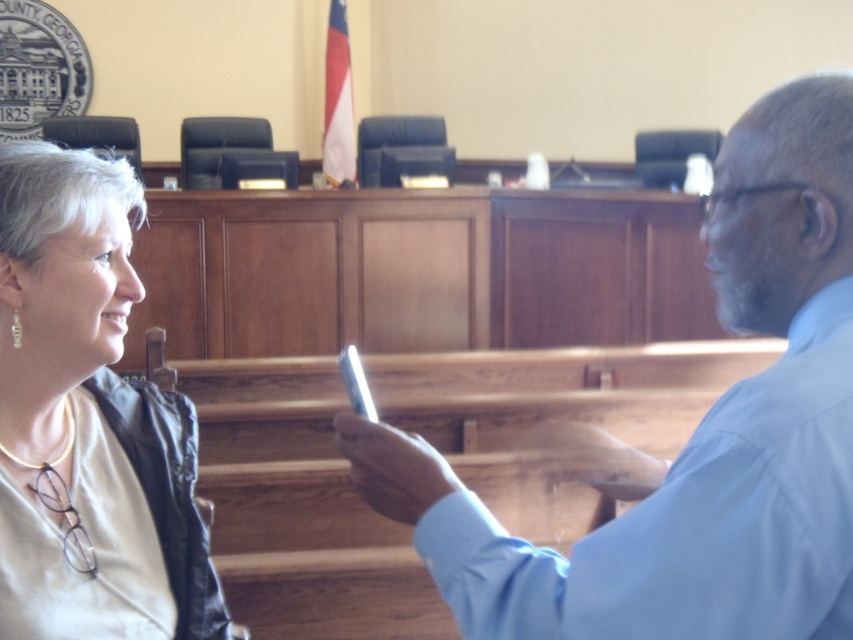
Question: Does light blue shirt at center appear over matte black jacket at left?

Choices:
 (A) no
 (B) yes

Answer: (B)

Question: Is light blue shirt at center below matte black jacket at left?

Choices:
 (A) no
 (B) yes

Answer: (A)

Question: Which point is farther to the camera?

Choices:
 (A) light blue shirt at center
 (B) matte black jacket at left

Answer: (B)

Question: Among these points, which one is nearest to the camera?

Choices:
 (A) (500, 628)
 (B) (45, 534)

Answer: (A)

Question: Does light blue shirt at center appear on the right side of matte black jacket at left?

Choices:
 (A) no
 (B) yes

Answer: (B)

Question: Among these objects, which one is nearest to the camera?

Choices:
 (A) matte black jacket at left
 (B) light blue shirt at center

Answer: (B)